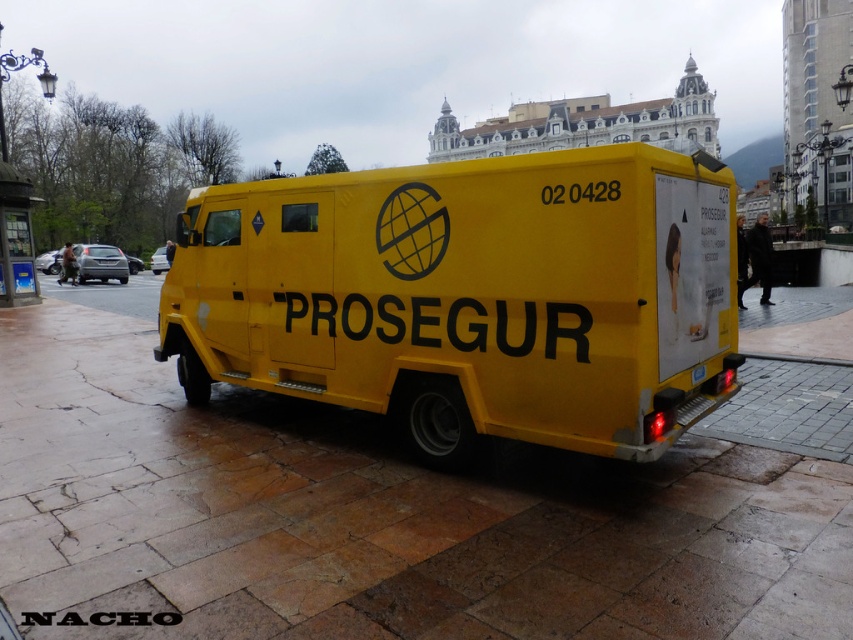
You are standing at the point marked by the coordinates [374,515] in the image. What material are you standing on?

The material at point [374,515] is yellow concrete pavement at center.

You are standing in the plaza and see the yellow concrete pavement at center and the yellow matte van at center. Which object is positioned lower in the image?

The yellow concrete pavement at center is located below the yellow matte van at center, so it is positioned lower in the image.